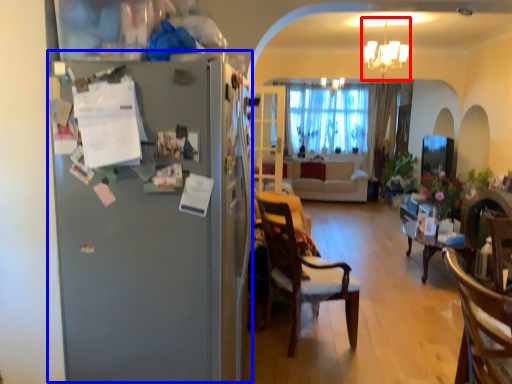
Question: Among these objects, which one is nearest to the camera, light fixture (highlighted by a red box) or fridge (highlighted by a blue box)?

Choices:
 (A) light fixture
 (B) fridge

Answer: (B)